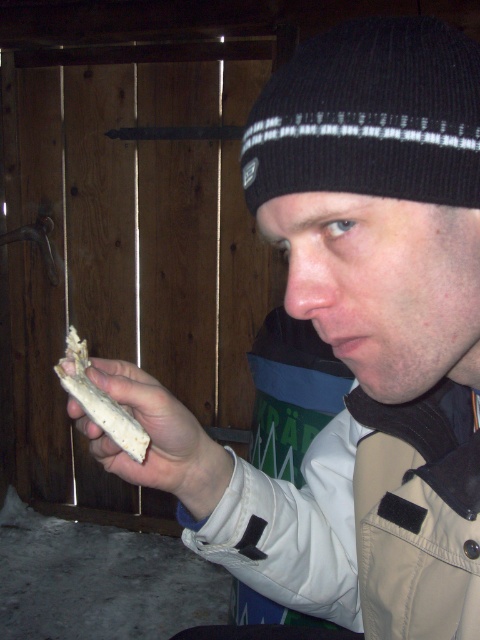
Question: Which point is farther from the camera taking this photo?

Choices:
 (A) [x=205, y=470]
 (B) [x=116, y=417]

Answer: (A)

Question: From the image, what is the correct spatial relationship of black knit beanie at upper center in relation to light brown leather hand at center?

Choices:
 (A) left
 (B) right

Answer: (B)

Question: Can you confirm if black knit beanie at upper center is thinner than white crumbly bread at center?

Choices:
 (A) no
 (B) yes

Answer: (A)

Question: Considering the relative positions of light brown leather hand at center and white crumbly bread at center in the image provided, where is light brown leather hand at center located with respect to white crumbly bread at center?

Choices:
 (A) right
 (B) left

Answer: (A)

Question: Estimate the real-world distances between objects in this image. Which object is farther from the black knit beanie at upper center?

Choices:
 (A) white crumbly bread at center
 (B) light brown leather hand at center

Answer: (A)

Question: Which of these objects is positioned farthest from the white crumbly bread at center?

Choices:
 (A) black knit beanie at upper center
 (B) light brown leather hand at center

Answer: (A)